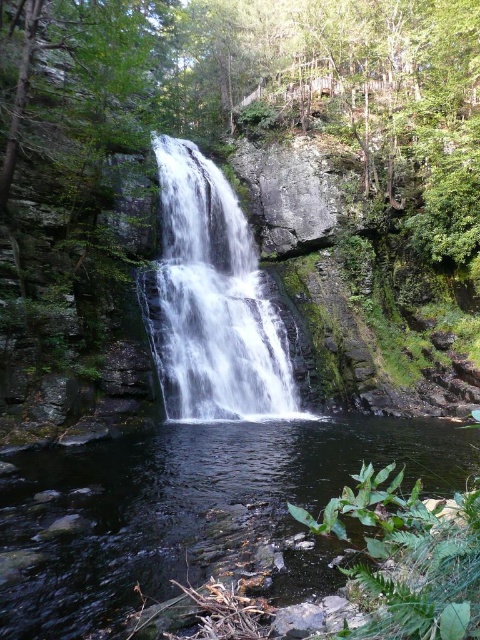
You are a drone operator trying to capture the waterfall. Your drone has a camera that can only focus on objects at coordinates between 0.7 and 0.4 on the x and y axes respectively. Is the clear water at center within the camera focus range?

The clear water at center is located at point 0.794 on the x and 0.385 on the y axis. Since both coordinates fall within the specified range of 0.7 to 0.4, the clear water at center is within the camera focus range.

You are a photographer planning to capture the waterfall and the pool. You need to know if the clear water at center is wider than the white smooth waterfall at center to adjust your camera angle. Can you tell me which one is wider?

The clear water at center might be wider than the white smooth waterfall at center according to the description.

You are standing at the base of the waterfall and want to take a photo. There are two points of interest marked as point 1 at coordinates point 1 at coordinates point [29,634] and point 2 at coordinates point [248,257]. Which point is closer to you?

Point [29,634] is in front of point [248,257], so it is closer to you.